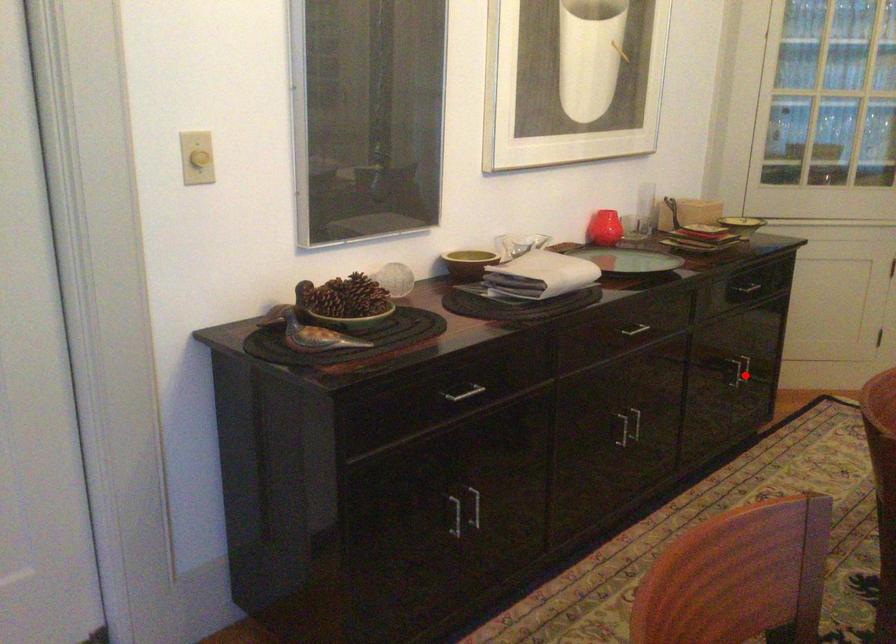
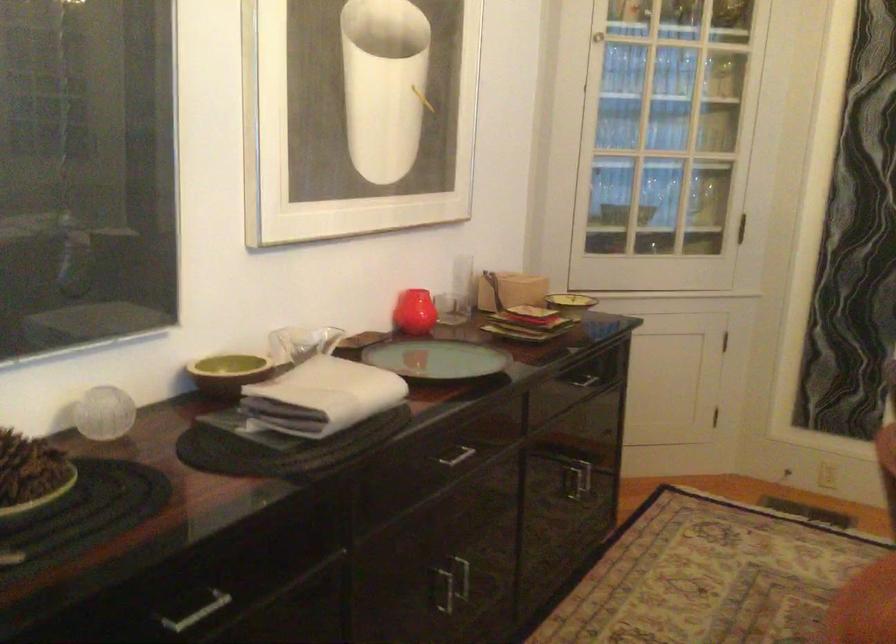
Question: I am providing you with two images of the same scene from different viewpoints. In image1, a red point is highlighted. Considering the same 3D point in image2, which of the following is correct?

Choices:
 (A) It is closer
 (B) It is farther

Answer: (A)